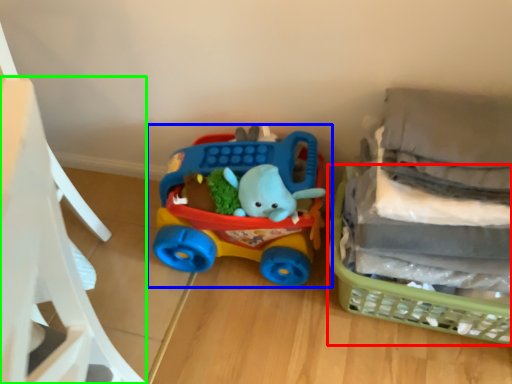
Question: Which is farther away from basket (highlighted by a red box)? toy (highlighted by a blue box) or chair (highlighted by a green box)?

Choices:
 (A) toy
 (B) chair

Answer: (B)